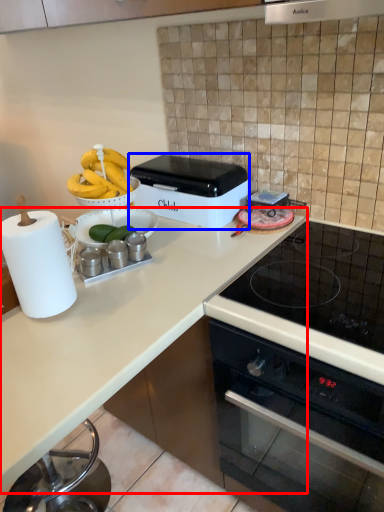
Question: Which object appears closest to the camera in this image, countertop (highlighted by a red box) or kitchen appliance (highlighted by a blue box)?

Choices:
 (A) countertop
 (B) kitchen appliance

Answer: (A)